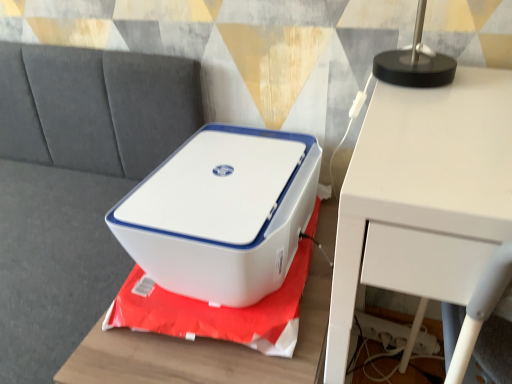
Question: Should I look upward or downward to see white plastic printer at center?

Choices:
 (A) up
 (B) down

Answer: (B)

Question: From a real-world perspective, is gray fabric couch at upper left positioned over white plastic printer at center based on gravity?

Choices:
 (A) yes
 (B) no

Answer: (A)

Question: Can you confirm if gray fabric couch at upper left is smaller than white plastic printer at center?

Choices:
 (A) yes
 (B) no

Answer: (B)

Question: Does gray fabric couch at upper left have a larger size compared to white plastic printer at center?

Choices:
 (A) yes
 (B) no

Answer: (A)

Question: Is the position of gray fabric couch at upper left more distant than that of white plastic printer at center?

Choices:
 (A) no
 (B) yes

Answer: (A)

Question: Does gray fabric couch at upper left have a lesser width compared to white plastic printer at center?

Choices:
 (A) no
 (B) yes

Answer: (A)

Question: Is gray fabric couch at upper left closer to camera compared to white plastic printer at center?

Choices:
 (A) yes
 (B) no

Answer: (A)

Question: Considering the relative positions of white plastic printer at center and white matte table at upper right in the image provided, is white plastic printer at center to the right of white matte table at upper right from the viewer's perspective?

Choices:
 (A) no
 (B) yes

Answer: (A)

Question: Does white plastic printer at center come behind white matte table at upper right?

Choices:
 (A) no
 (B) yes

Answer: (B)

Question: From a real-world perspective, is white plastic printer at center beneath white matte table at upper right?

Choices:
 (A) yes
 (B) no

Answer: (B)

Question: Is white plastic printer at center to the left of white matte table at upper right from the viewer's perspective?

Choices:
 (A) yes
 (B) no

Answer: (A)

Question: From the image's perspective, is white plastic printer at center on white matte table at upper right?

Choices:
 (A) yes
 (B) no

Answer: (A)

Question: Is white plastic printer at center located outside white matte table at upper right?

Choices:
 (A) yes
 (B) no

Answer: (A)

Question: From the image's perspective, is white plastic printer at center on white matte table at upper right?

Choices:
 (A) no
 (B) yes

Answer: (A)